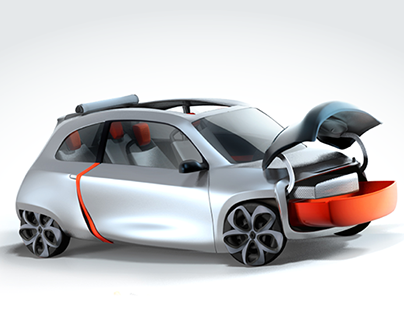
This screenshot has width=404, height=316. I want to click on right mirror, so click(192, 168).